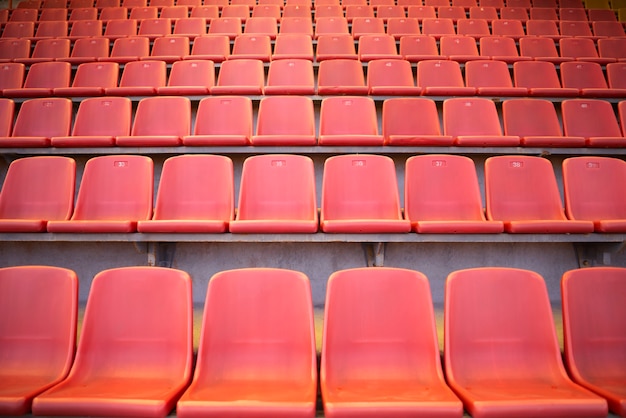
The width and height of the screenshot is (626, 418). Identify the location of riser tops. (313, 1), (314, 10), (314, 20), (314, 40), (313, 62), (316, 96), (316, 145), (317, 236).